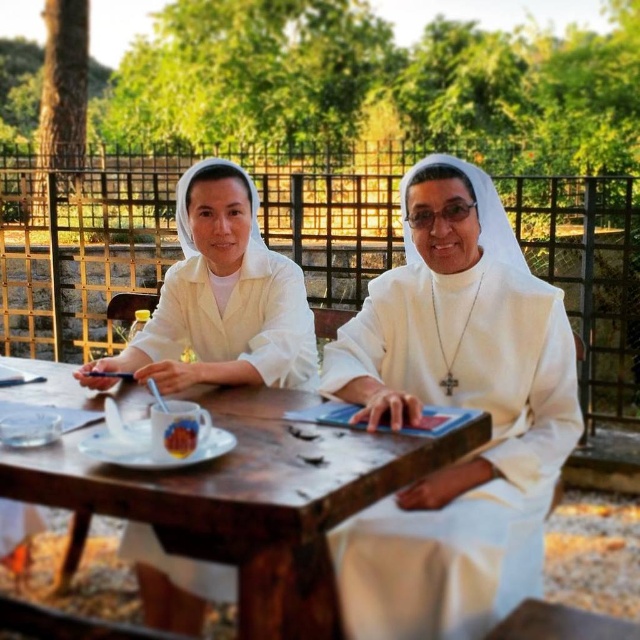
Who is positioned more to the left, wooden table at center or smooth brown bread at center?

From the viewer's perspective, wooden table at center appears more on the left side.

Between wooden table at center and smooth brown bread at center, which one is positioned higher?

smooth brown bread at center

Between point (196, 512) and point (186, 436), which one is positioned behind?

Positioned behind is point (186, 436).

Locate an element on the screen. The width and height of the screenshot is (640, 640). wooden table at center is located at coordinates (244, 500).

Which is in front, point (416, 291) or point (172, 448)?

Positioned in front is point (172, 448).

Describe the element at coordinates (458, 404) in the screenshot. I see `white matte nun at center` at that location.

I want to click on white matte nun at center, so [x=458, y=404].

In the scene shown: Can you confirm if white matte nun's habit at center is thinner than smooth brown bread at center?

In fact, white matte nun's habit at center might be wider than smooth brown bread at center.

Which is more to the right, white matte nun's habit at center or smooth brown bread at center?

From the viewer's perspective, smooth brown bread at center appears more on the right side.

This screenshot has width=640, height=640. In order to click on white matte nun's habit at center in this screenshot , I will do `click(221, 298)`.